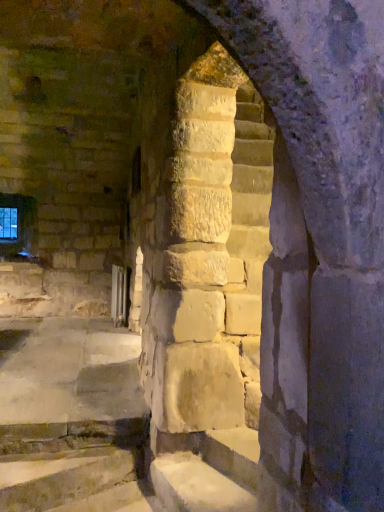
Question: Can we say transparent glass window at upper left lies outside smooth stone stairs at center?

Choices:
 (A) yes
 (B) no

Answer: (A)

Question: From a real-world perspective, is transparent glass window at upper left physically above smooth stone stairs at center?

Choices:
 (A) yes
 (B) no

Answer: (A)

Question: Considering the relative sizes of transparent glass window at upper left and smooth stone stairs at center in the image provided, is transparent glass window at upper left wider than smooth stone stairs at center?

Choices:
 (A) no
 (B) yes

Answer: (A)

Question: Does transparent glass window at upper left have a lesser height compared to smooth stone stairs at center?

Choices:
 (A) no
 (B) yes

Answer: (A)

Question: Is smooth stone stairs at center located within transparent glass window at upper left?

Choices:
 (A) no
 (B) yes

Answer: (A)

Question: Considering the relative positions of transparent glass window at upper left and smooth stone stairs at center in the image provided, is transparent glass window at upper left to the left of smooth stone stairs at center from the viewer's perspective?

Choices:
 (A) no
 (B) yes

Answer: (B)

Question: Is smooth stone stairs at center positioned with its back to transparent glass window at upper left?

Choices:
 (A) yes
 (B) no

Answer: (B)

Question: Does smooth stone stairs at center have a greater height compared to transparent glass window at upper left?

Choices:
 (A) yes
 (B) no

Answer: (B)

Question: From a real-world perspective, is smooth stone stairs at center beneath transparent glass window at upper left?

Choices:
 (A) yes
 (B) no

Answer: (A)

Question: Does smooth stone stairs at center contain transparent glass window at upper left?

Choices:
 (A) yes
 (B) no

Answer: (B)

Question: Can you confirm if smooth stone stairs at center is bigger than transparent glass window at upper left?

Choices:
 (A) no
 (B) yes

Answer: (B)

Question: Can you confirm if smooth stone stairs at center is positioned to the left of transparent glass window at upper left?

Choices:
 (A) no
 (B) yes

Answer: (A)

Question: Considering the positions of smooth stone stairs at center and transparent glass window at upper left in the image, is smooth stone stairs at center bigger or smaller than transparent glass window at upper left?

Choices:
 (A) big
 (B) small

Answer: (A)